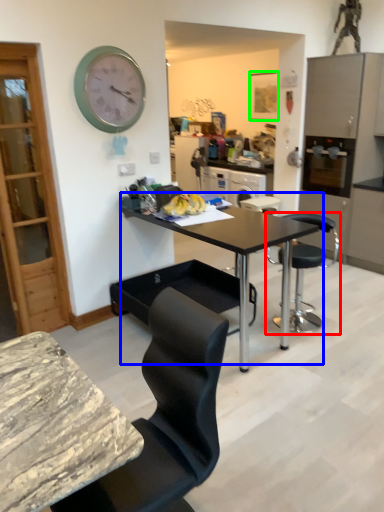
Question: Which object is the farthest from chair (highlighted by a red box)? Choose among these: table (highlighted by a blue box) or picture frame (highlighted by a green box).

Choices:
 (A) table
 (B) picture frame

Answer: (B)